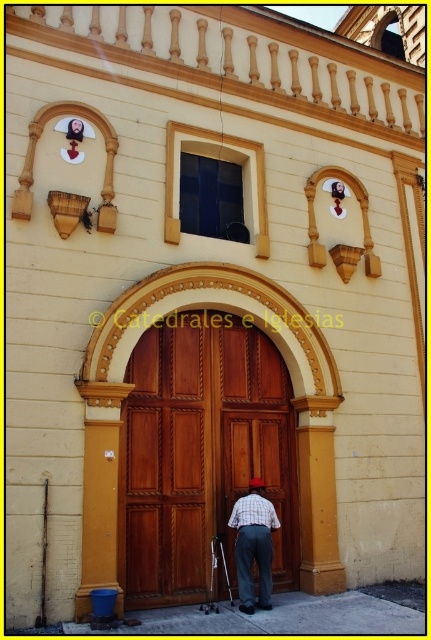
You are an architect planning to install a new security system. You need to place a sensor on the wooden door at center and another sensor on the wooden at center. Which sensor should be placed higher to ensure both sensors are at the same height level?

The wooden door at center is smaller than the wooden at center, so the sensor on the wooden door at center should be placed higher to match the height of the sensor on the wooden at center.

You are standing in front of the building and want to see the wooden at center clearly. Is the plaid fabric pants at center blocking your view of it?

The plaid fabric pants at center is behind the wooden at center, so it is not blocking the view of the wooden at center.